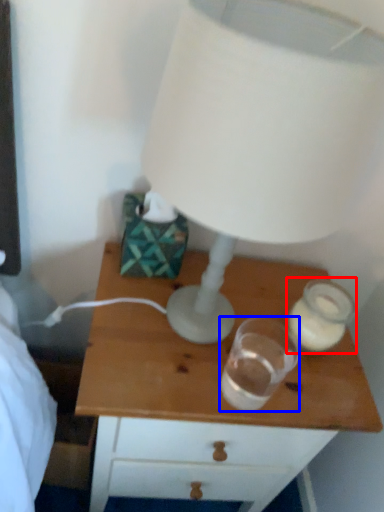
Question: Which object appears farthest to the camera in this image, candle holder (highlighted by a red box) or candle holder (highlighted by a blue box)?

Choices:
 (A) candle holder
 (B) candle holder

Answer: (A)